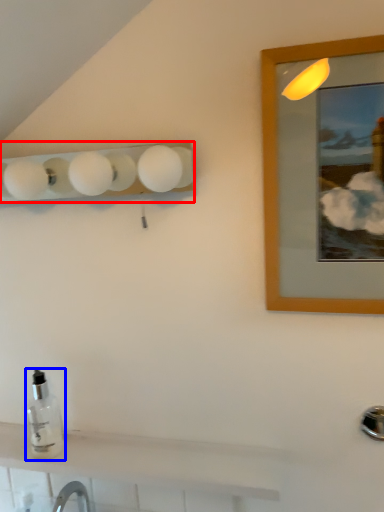
Question: Among these objects, which one is nearest to the camera, lamp (highlighted by a red box) or bottle (highlighted by a blue box)?

Choices:
 (A) lamp
 (B) bottle

Answer: (A)